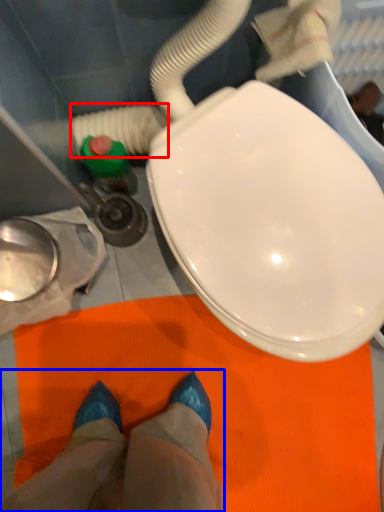
Question: Which object appears farthest to the camera in this image, water pipe (highlighted by a red box) or person (highlighted by a blue box)?

Choices:
 (A) water pipe
 (B) person

Answer: (B)